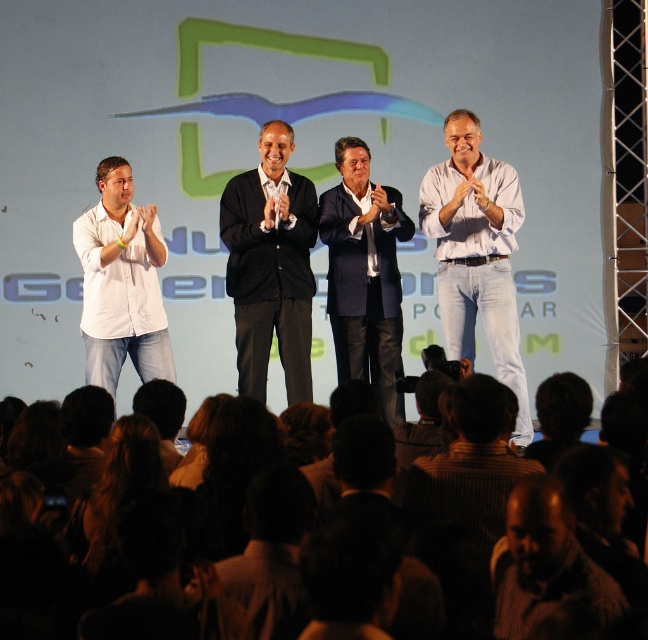
Question: Can you confirm if navy blue suit at center is positioned below striped shirt at lower right?

Choices:
 (A) no
 (B) yes

Answer: (A)

Question: Is dark brown hair at lower center to the right of navy blue suit at center from the viewer's perspective?

Choices:
 (A) no
 (B) yes

Answer: (A)

Question: Does dark brown hair at lower center have a smaller size compared to black cardigan at center?

Choices:
 (A) no
 (B) yes

Answer: (A)

Question: Which point is farther from the camera taking this photo?

Choices:
 (A) (542, 545)
 (B) (559, 636)

Answer: (A)

Question: Which point is closer to the camera?

Choices:
 (A) navy blue suit at center
 (B) black cardigan at center
 (C) striped shirt at lower right

Answer: (C)

Question: Which object is the farthest from the white denim jeans at center?

Choices:
 (A) black cardigan at center
 (B) white matte shirt at left

Answer: (B)